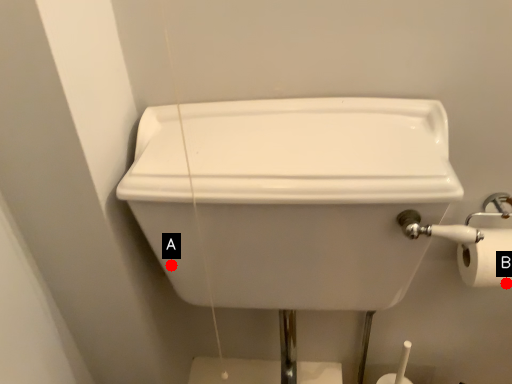
Question: Two points are circled on the image, labeled by A and B beside each circle. Which point is farther to the camera?

Choices:
 (A) A is further
 (B) B is further

Answer: (B)